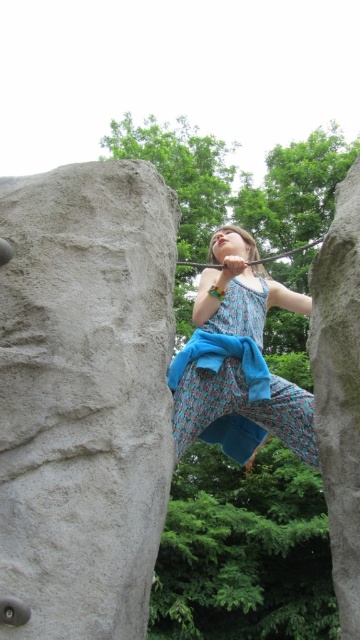
You are a photographer trying to capture the girl in her floral dress at center while ensuring the smooth gray rock at right is visible in the frame. Given the size difference between the two, which object should you prioritize framing first to ensure both are visible?

The floral dress at center is wider than the smooth gray rock at right, so you should prioritize framing the floral dress at center first to accommodate its larger size, ensuring there is enough space for the smooth gray rock at right in the frame.

Based on the scene described, can you determine which object is taller between the floral dress at center and the smooth gray rock at right?

The smooth gray rock at right is taller than the floral dress at center.

You are standing at the origin point of the image. You see a gray rough rock at left located at point [84,394]. If you want to reach the gray rough rock at left, which direction should you move in?

You should move towards the left direction to reach the gray rough rock at left located at point [84,394].